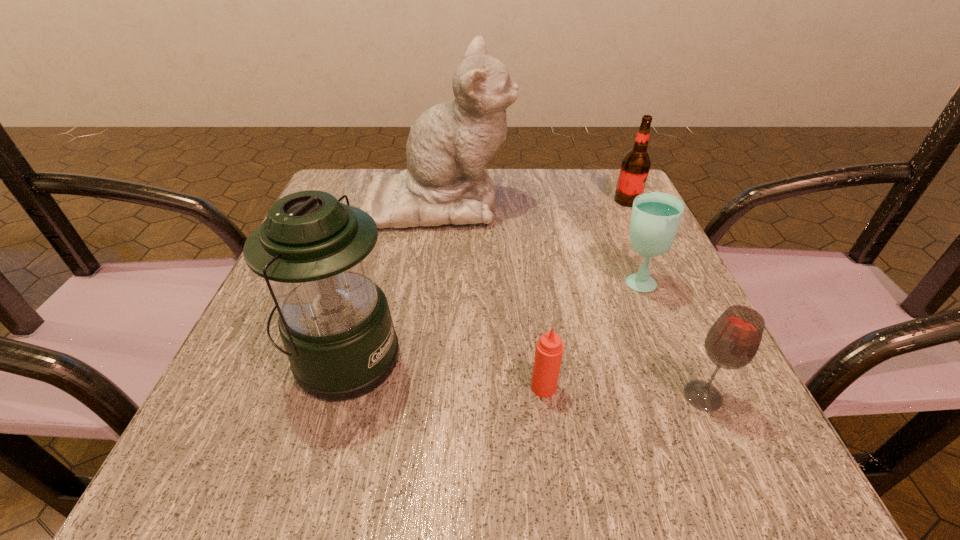
Locate an element on the screen. This screenshot has width=960, height=540. free spot that satisfies the following two spatial constraints: 1. on the front side of the nearer glass drink container; 2. on the right side of the farther glass drink container is located at coordinates (683, 396).